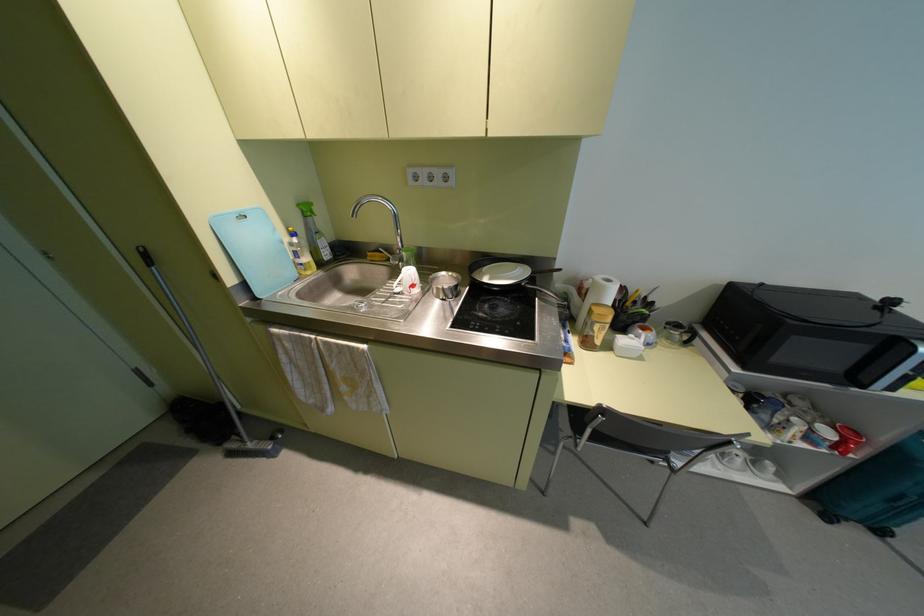
Find where to lift the red mug. Please return your answer as a coordinate pair (x, y).

(846, 440)